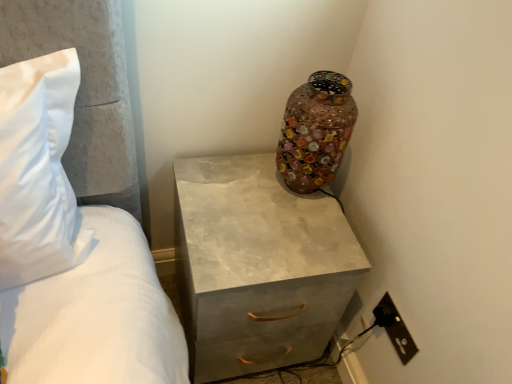
Locate an element on the screen. The width and height of the screenshot is (512, 384). free space that is to the left of multicolored mosaic vase at upper right is located at coordinates (232, 180).